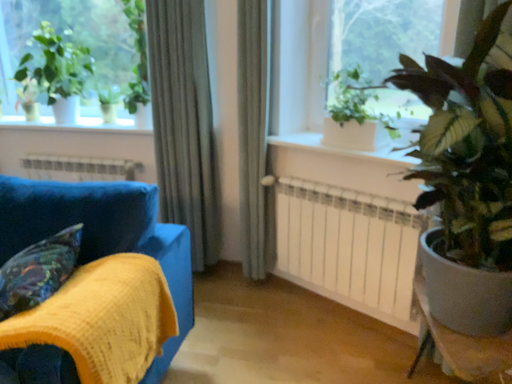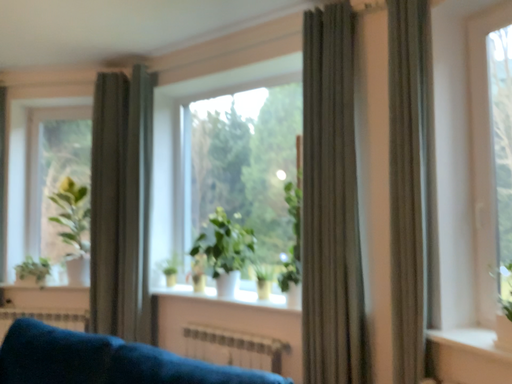
Question: How did the camera likely rotate when shooting the video?

Choices:
 (A) rotated left
 (B) rotated right

Answer: (A)